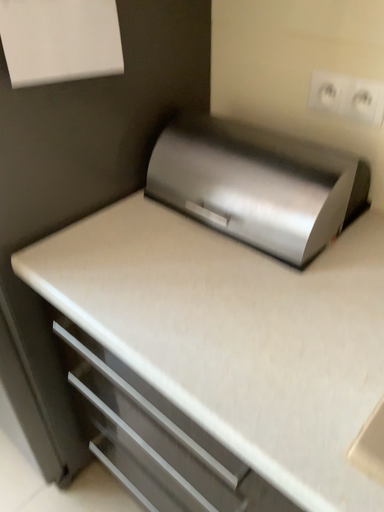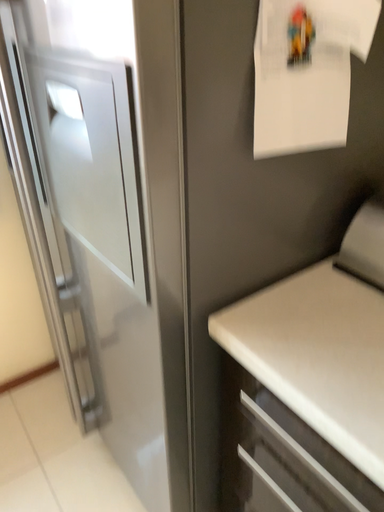
Question: Which way did the camera rotate in the video?

Choices:
 (A) rotated upward
 (B) rotated downward

Answer: (A)